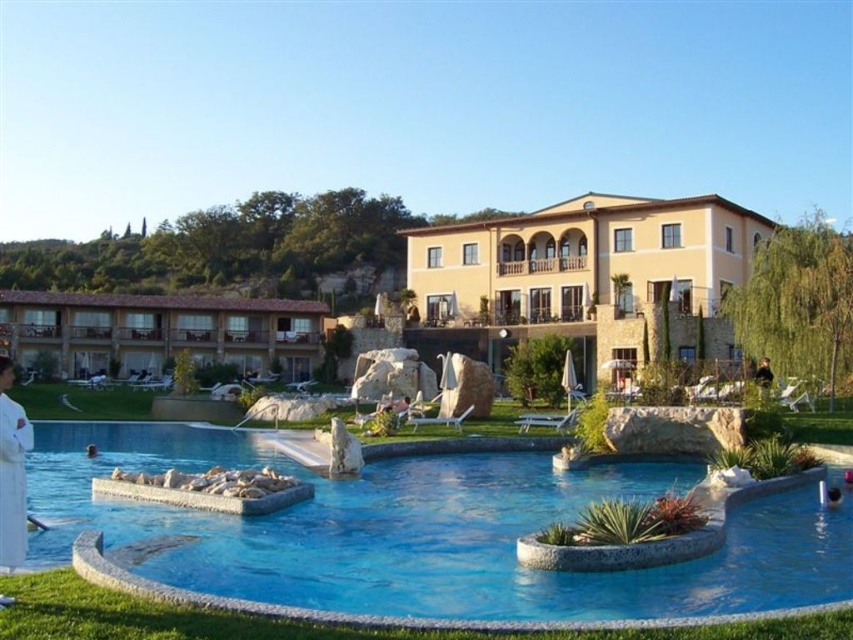
Question: Is beige stucco building at center to the right of brown tile roof resort at left from the viewer's perspective?

Choices:
 (A) yes
 (B) no

Answer: (A)

Question: Which of these objects is positioned farthest from the beige stucco building at center?

Choices:
 (A) blue stone pool at center
 (B) brown tile roof resort at left

Answer: (A)

Question: Which point is closer to the camera?

Choices:
 (A) blue stone pool at center
 (B) brown tile roof resort at left

Answer: (A)

Question: Which of the following is the closest to the observer?

Choices:
 (A) (76, 328)
 (B) (12, 376)
 (C) (575, 474)
 (D) (659, 209)

Answer: (B)

Question: Can you confirm if blue stone pool at center is positioned below beige stucco building at center?

Choices:
 (A) no
 (B) yes

Answer: (B)

Question: Can you confirm if brown tile roof resort at left is positioned below white cotton robe at lower left?

Choices:
 (A) no
 (B) yes

Answer: (A)